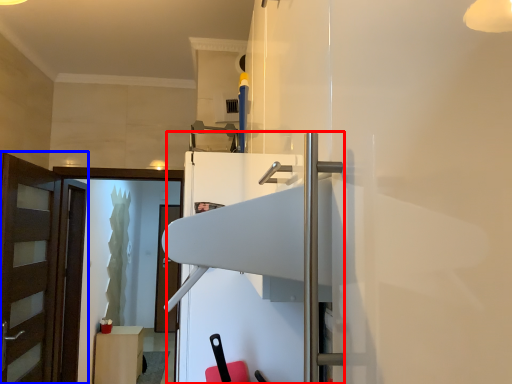
Question: Which object is further to the camera taking this photo, fridge (highlighted by a red box) or door (highlighted by a blue box)?

Choices:
 (A) fridge
 (B) door

Answer: (B)